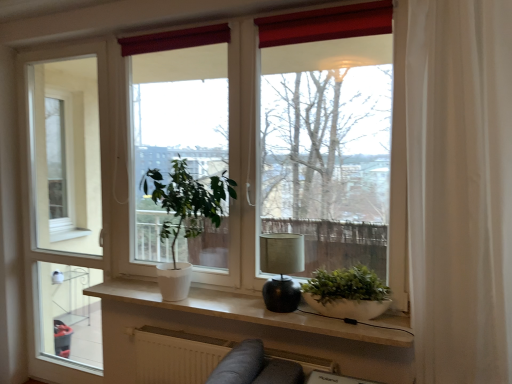
Locate an element on the screen. The height and width of the screenshot is (384, 512). free spot below white matte plant at center, which is the 1th houseplant from left to right (from a real-world perspective) is located at coordinates (197, 298).